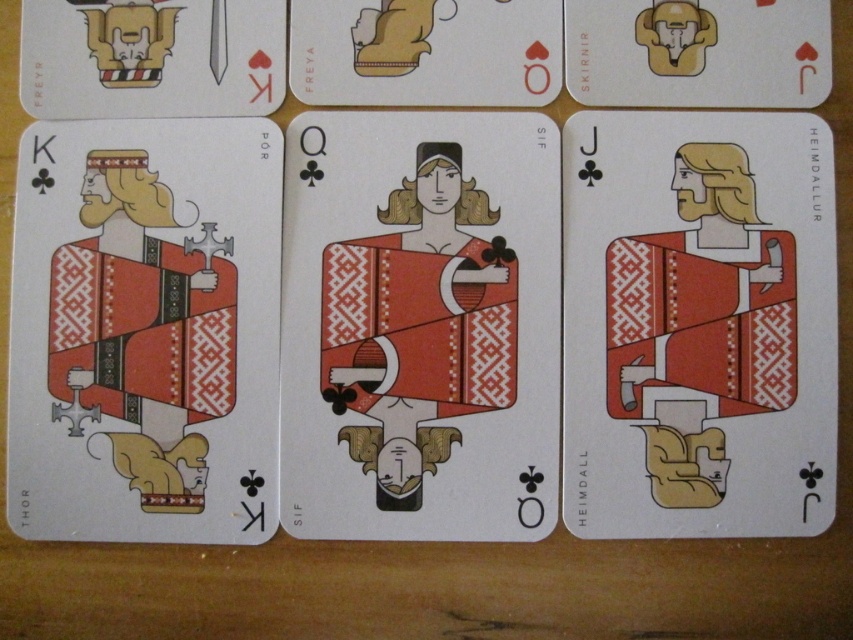
Is the position of matte red card at right less distant than that of matte gold sword at upper left?

Yes, matte red card at right is in front of matte gold sword at upper left.

How far apart are matte red card at right and matte gold sword at upper left?

A distance of 27.38 centimeters exists between matte red card at right and matte gold sword at upper left.

Between point (747, 385) and point (50, 61), which one is positioned behind?

The point (50, 61) is more distant.

Identify the location of matte red card at right. This screenshot has height=640, width=853. (698, 324).

Is matte red dress at center in front of matte red fabric king at left?

Answer: No, matte red dress at center is behind matte red fabric king at left.

Can you confirm if matte red dress at center is smaller than matte red fabric king at left?

No, matte red dress at center is not smaller than matte red fabric king at left.

Does point (309, 440) lie behind point (248, 262)?

No, (309, 440) is in front of (248, 262).

Identify the location of matte red dress at center. (421, 326).

Who is positioned more to the right, matte red fabric king at left or matte gold sword at upper left?

matte gold sword at upper left

Who is taller, matte red fabric king at left or matte gold sword at upper left?

matte red fabric king at left is taller.

Which is behind, point (187, 500) or point (143, 61)?

The point (143, 61) is more distant.

Where is `matte red fabric king at left`? The width and height of the screenshot is (853, 640). matte red fabric king at left is located at coordinates (144, 332).